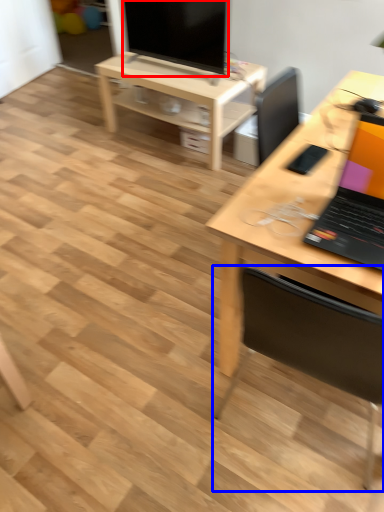
Question: Which point is further to the camera, television (highlighted by a red box) or chair (highlighted by a blue box)?

Choices:
 (A) television
 (B) chair

Answer: (A)